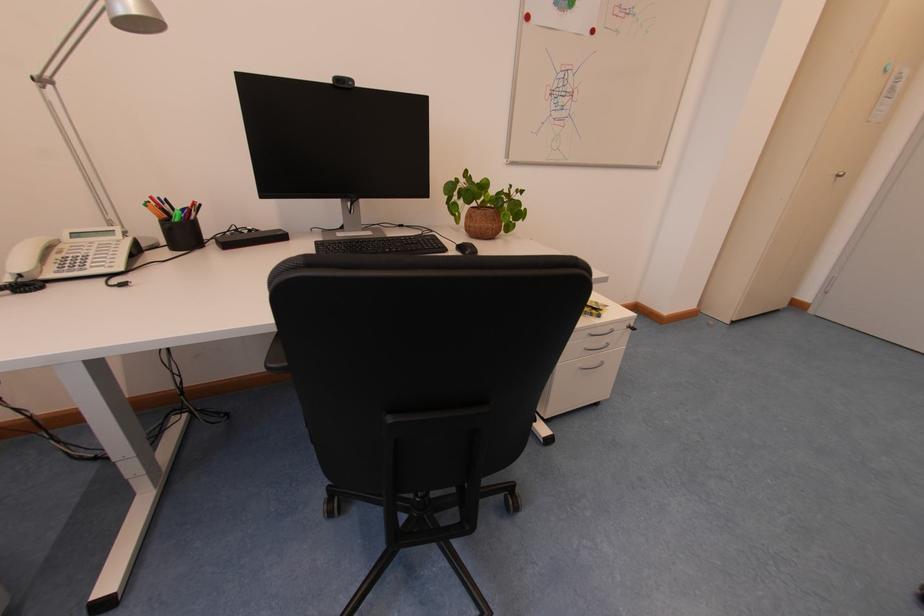
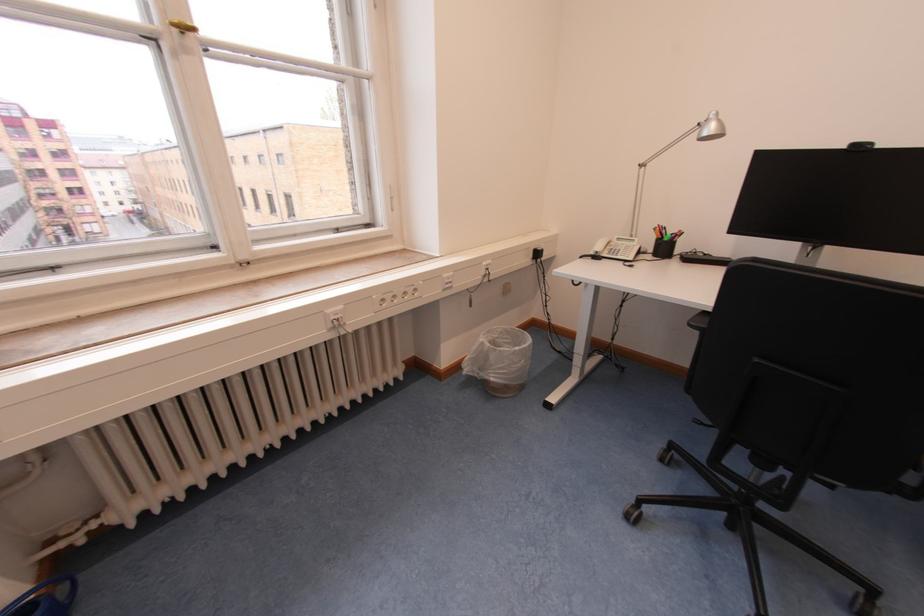
In the second image, find the point that corresponds to (159,200) in the first image.

(665, 228)